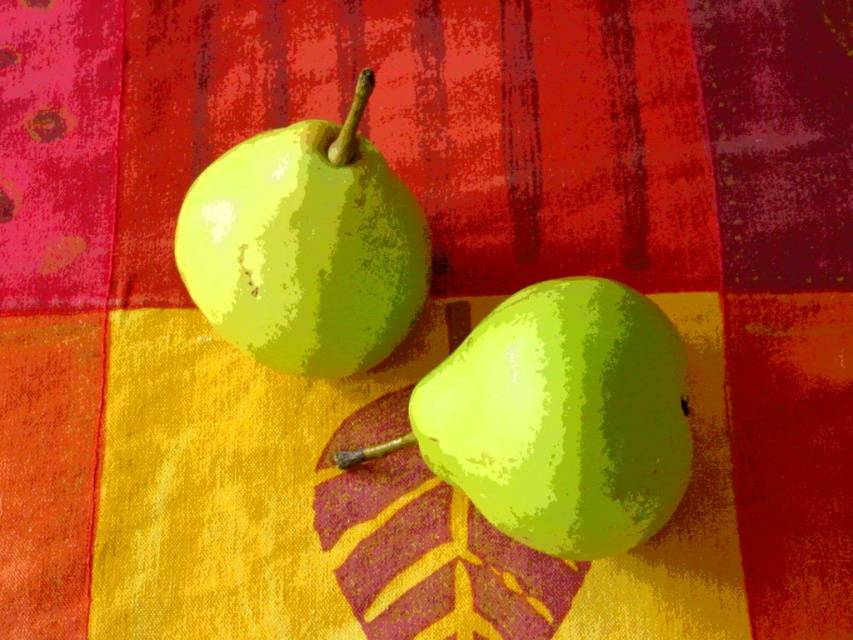
Which of these two, green matte pear at center or green matte pear at upper left, stands taller?

With more height is green matte pear at center.

Is green matte pear at center smaller than green matte pear at upper left?

Correct, green matte pear at center occupies less space than green matte pear at upper left.

Locate an element on the screen. The image size is (853, 640). green matte pear at center is located at coordinates pyautogui.click(x=563, y=417).

In order to click on green matte pear at center in this screenshot , I will do pyautogui.click(x=563, y=417).